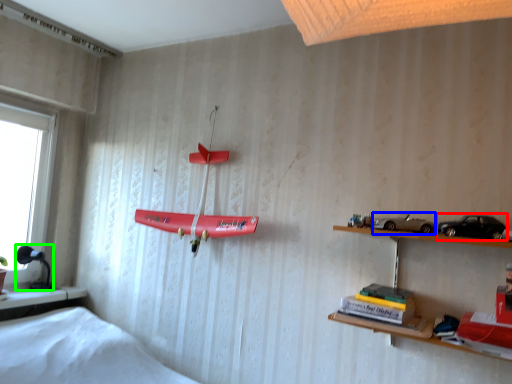
Question: Based on their relative distances, which object is farther from toy car (highlighted by a red box)? Choose from toy car (highlighted by a blue box) and lamp (highlighted by a green box).

Choices:
 (A) toy car
 (B) lamp

Answer: (B)